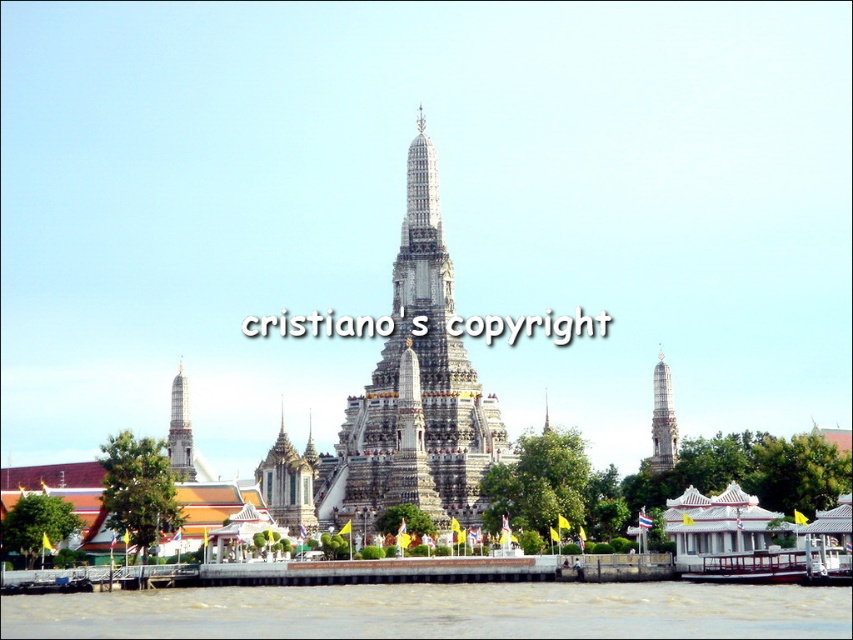
Question: Can you confirm if silver metallic spire at lower left is thinner than white marble tower at left?

Choices:
 (A) yes
 (B) no

Answer: (A)

Question: Which object appears closest to the camera in this image?

Choices:
 (A) brown muddy water at lower center
 (B) white marble tower at left

Answer: (A)

Question: Which point appears closest to the camera in this image?

Choices:
 (A) (461, 460)
 (B) (84, 625)

Answer: (B)

Question: Does white stone temple at center appear under silver metallic spire at lower left?

Choices:
 (A) no
 (B) yes

Answer: (A)

Question: Estimate the real-world distances between objects in this image. Which object is farther from the brown muddy water at lower center?

Choices:
 (A) silver metallic spire at lower left
 (B) white stone temple at center
 (C) white marble tower at left
 (D) white stone tower at right

Answer: (D)

Question: Considering the relative positions of brown muddy water at lower center and white stone tower at right in the image provided, where is brown muddy water at lower center located with respect to white stone tower at right?

Choices:
 (A) left
 (B) right

Answer: (A)